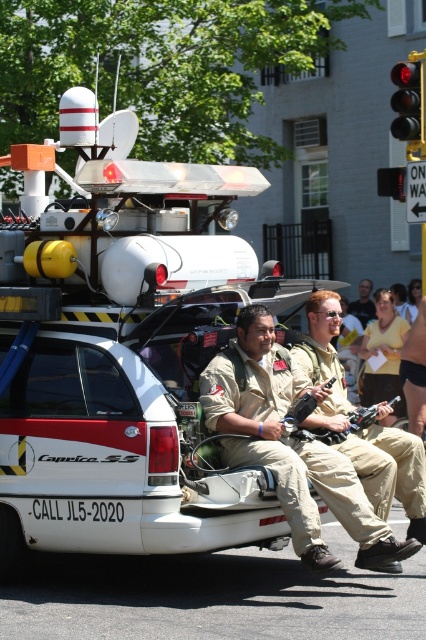
Based on the scene description, if you were standing in front of the white vehicle with the text Caprice SS and CALL JL5 2020, where would the tan uniform at center be in relation to the black plastic traffic light at upper right?

The tan uniform at center is below the black plastic traffic light at upper right.